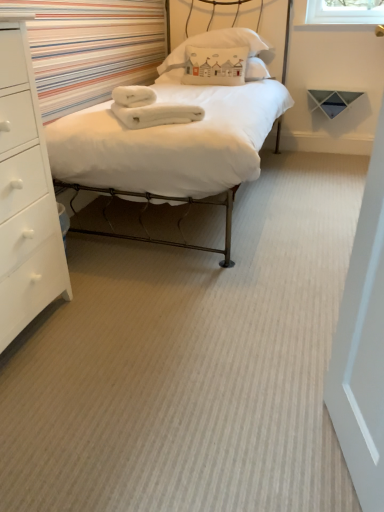
Image resolution: width=384 pixels, height=512 pixels. What do you see at coordinates (149, 108) in the screenshot? I see `white fluffy towels at center` at bounding box center [149, 108].

The height and width of the screenshot is (512, 384). I want to click on white soft bed at center, so click(x=155, y=162).

Measure the distance between point (97,233) and camera.

The depth of point (97,233) is 7.30 feet.

Image resolution: width=384 pixels, height=512 pixels. I want to click on white matte chest of drawers at left, so (25, 196).

From the picture: Can you confirm if white soft bed at center is thinner than white matte chest of drawers at left?

In fact, white soft bed at center might be wider than white matte chest of drawers at left.

Consider the image. From a real-world perspective, which is physically below, white soft bed at center or white matte chest of drawers at left?

white matte chest of drawers at left is physically lower.

Can you confirm if white soft bed at center is positioned to the right of white matte chest of drawers at left?

Correct, you'll find white soft bed at center to the right of white matte chest of drawers at left.

Is white soft bed at center turned away from white matte chest of drawers at left?

That's not correct — white soft bed at center is not looking away from white matte chest of drawers at left.

You are a GUI agent. You are given a task and a screenshot of the screen. Output one action in this format:
    pyautogui.click(x=<x>, y=<y>)
    Task: Click on the material that appears above the white matte chest of drawers at left (from a real-world perspective)
    Image resolution: width=384 pixels, height=512 pixels.
    Given the screenshot: What is the action you would take?
    pyautogui.click(x=149, y=108)

Based on the photo, which object is wider, white fluffy towels at center or white matte chest of drawers at left?

With larger width is white matte chest of drawers at left.

From the image's perspective, is white fluffy towels at center above white matte chest of drawers at left?

Yes, from the image's perspective, white fluffy towels at center is on top of white matte chest of drawers at left.

Is the position of white fluffy towels at center more distant than that of white matte chest of drawers at left?

Yes, white fluffy towels at center is behind white matte chest of drawers at left.

Which of these two, white soft bed at center or white cotton pillow at upper center, is thinner?

Thinner between the two is white cotton pillow at upper center.

From the picture: Could you tell me if white soft bed at center is turned towards white cotton pillow at upper center?

No, white soft bed at center is not turned towards white cotton pillow at upper center.

Is white cotton pillow at upper center located within white soft bed at center?

Absolutely, white cotton pillow at upper center is inside white soft bed at center.

From a real-world perspective, between white soft bed at center and white cotton pillow at upper center, who is vertically lower?

From a 3D spatial view, white soft bed at center is below.

Between white fluffy towels at center and white soft bed at center, which one has more height?

white soft bed at center is taller.

Between point (201, 117) and point (205, 86), which one is positioned in front?

The point (201, 117) is in front.

Which is more to the left, white fluffy towels at center or white soft bed at center?

Positioned to the left is white fluffy towels at center.

Is white fluffy towels at center looking in the opposite direction of white soft bed at center?

Yes, white soft bed at center is at the back of white fluffy towels at center.

From the image's perspective, which one is positioned lower, white cotton pillow at upper center or white matte chest of drawers at left?

From the image's view, white matte chest of drawers at left is below.

You are a GUI agent. You are given a task and a screenshot of the screen. Output one action in this format:
    pyautogui.click(x=<x>, y=<y>)
    Task: Click on the chest of drawers below the white cotton pillow at upper center (from the image's perspective)
    This screenshot has height=512, width=384.
    Given the screenshot: What is the action you would take?
    pyautogui.click(x=25, y=196)

Based on the photo, is white cotton pillow at upper center facing towards white matte chest of drawers at left?

Yes, white cotton pillow at upper center faces towards white matte chest of drawers at left.

Does point (174, 60) come closer to viewer compared to point (119, 106)?

No, (174, 60) is behind (119, 106).

Is white cotton pillow at upper center positioned with its back to white fluffy towels at center?

No, white cotton pillow at upper center is not facing away from white fluffy towels at center.

You are a GUI agent. You are given a task and a screenshot of the screen. Output one action in this format:
    pyautogui.click(x=<x>, y=<y>)
    Task: Click on the material on the left side of white cotton pillow at upper center
    
    Given the screenshot: What is the action you would take?
    pyautogui.click(x=149, y=108)

Which is closer, [226,47] or [119,149]?

The point [119,149] is closer to the camera.

How much distance is there between white cotton pillow at upper center and white soft bed at center?

1.07 meters.

Is white cotton pillow at upper center facing away from white soft bed at center?

Yes, white cotton pillow at upper center's orientation is away from white soft bed at center.

Considering the sizes of objects white cotton pillow at upper center and white soft bed at center in the image provided, who is shorter, white cotton pillow at upper center or white soft bed at center?

With less height is white cotton pillow at upper center.

Find the location of `bed behind the white matte chest of drawers at left`. bed behind the white matte chest of drawers at left is located at coordinates (155, 162).

Locate an element on the screen. The image size is (384, 512). material that is above the white matte chest of drawers at left (from the image's perspective) is located at coordinates (149, 108).

Considering their positions, is white soft bed at center positioned further to white cotton pillow at upper center than white matte chest of drawers at left?

white matte chest of drawers at left is positioned further to the anchor white cotton pillow at upper center.

Which object lies further to the anchor point white soft bed at center, white fluffy towels at center or white cotton pillow at upper center?

Based on the image, white cotton pillow at upper center appears to be further to white soft bed at center.

Considering their positions, is white matte chest of drawers at left positioned closer to white soft bed at center than white cotton pillow at upper center?

white matte chest of drawers at left is positioned closer to the anchor white soft bed at center.

From the image, which object appears to be farther from white soft bed at center, white fluffy towels at center or white matte chest of drawers at left?

white matte chest of drawers at left is further to white soft bed at center.

Consider the image. From the image, which object appears to be nearer to white soft bed at center, white cotton pillow at upper center or white matte chest of drawers at left?

white matte chest of drawers at left.

Considering their positions, is white soft bed at center positioned further to white matte chest of drawers at left than white cotton pillow at upper center?

white cotton pillow at upper center.

Which object lies nearer to the anchor point white fluffy towels at center, white matte chest of drawers at left or white soft bed at center?

The object closer to white fluffy towels at center is white soft bed at center.

Based on their spatial positions, is white soft bed at center or white cotton pillow at upper center closer to white fluffy towels at center?

white soft bed at center is closer to white fluffy towels at center.

This screenshot has height=512, width=384. Find the location of `material located between white matte chest of drawers at left and white cotton pillow at upper center in the depth direction`. material located between white matte chest of drawers at left and white cotton pillow at upper center in the depth direction is located at coordinates (149, 108).

Locate an element on the screen. bed between white matte chest of drawers at left and white fluffy towels at center along the z-axis is located at coordinates point(155,162).

The height and width of the screenshot is (512, 384). In order to click on bed between white matte chest of drawers at left and white cotton pillow at upper center along the z-axis in this screenshot , I will do `click(155, 162)`.

Locate an element on the screen. The image size is (384, 512). material between white soft bed at center and white cotton pillow at upper center from front to back is located at coordinates (149, 108).